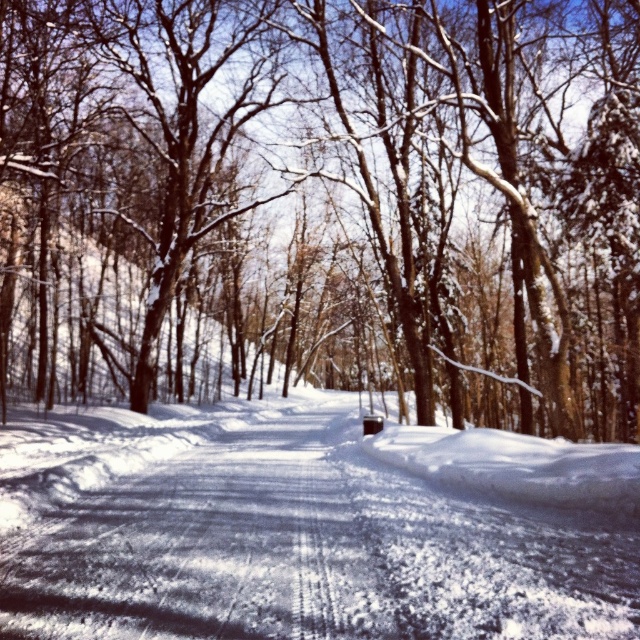
Question: Does snow-covered tree at center have a smaller size compared to white powdery snow at center?

Choices:
 (A) no
 (B) yes

Answer: (A)

Question: Can you confirm if snow-covered tree at center is positioned below white powdery snow at center?

Choices:
 (A) no
 (B) yes

Answer: (A)

Question: Which of the following is the closest to the observer?

Choices:
 (A) white powdery snow at center
 (B) snow-covered tree at center

Answer: (A)

Question: Which object appears farthest from the camera in this image?

Choices:
 (A) white powdery snow at center
 (B) snow-covered tree at center

Answer: (B)

Question: Can you confirm if snow-covered tree at center is bigger than white powdery snow at center?

Choices:
 (A) no
 (B) yes

Answer: (B)